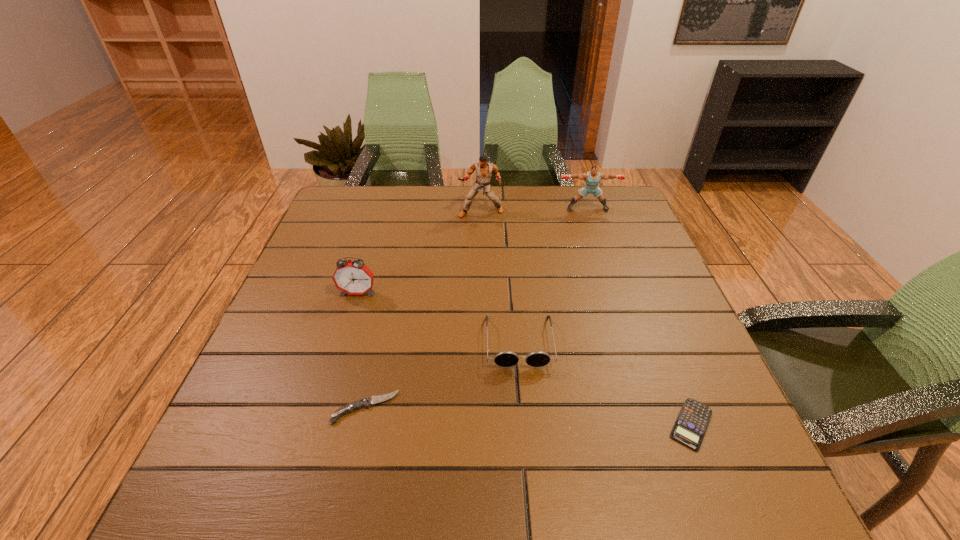
Locate an element on the screen. Image resolution: width=960 pixels, height=540 pixels. vacant area that lies between the pocketknife and the calculator is located at coordinates (528, 416).

At what (x,y) coordinates should I click in order to perform the action: click on free point between the left puncher and the shortest object. Please return your answer as a coordinate pair (x, y). The image size is (960, 540). Looking at the image, I should click on (x=587, y=319).

I want to click on vacant point located between the right puncher and the taller puncher, so click(x=534, y=211).

The width and height of the screenshot is (960, 540). In order to click on free space that is in between the second shortest object and the third nearest object in this screenshot , I will do `click(443, 375)`.

The width and height of the screenshot is (960, 540). What are the coordinates of `vacant space that is in between the pocketknife and the fourth farthest object` in the screenshot? It's located at (443, 375).

Identify the location of object that is the third closest to the second shortest object. The image size is (960, 540). (690, 427).

Locate an element on the screen. The width and height of the screenshot is (960, 540). the second closest object to the fifth tallest object is located at coordinates (353, 277).

Image resolution: width=960 pixels, height=540 pixels. Find the location of `free space that satisfies the following two spatial constraints: 1. on the clock face of the shortest object; 2. on the left side of the fourth nearest object`. free space that satisfies the following two spatial constraints: 1. on the clock face of the shortest object; 2. on the left side of the fourth nearest object is located at coordinates (318, 424).

Locate an element on the screen. This screenshot has width=960, height=540. free point that satisfies the following two spatial constraints: 1. on the front side of the pocketknife; 2. on the left side of the calculator is located at coordinates (362, 424).